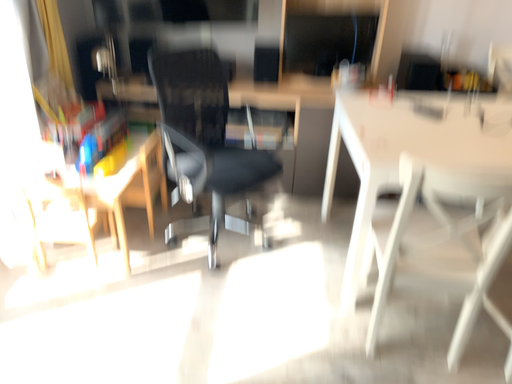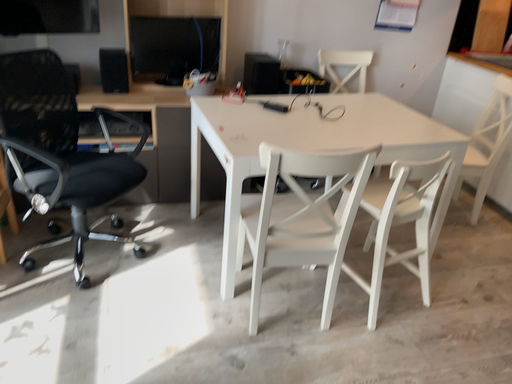
Question: How did the camera likely rotate when shooting the video?

Choices:
 (A) rotated left
 (B) rotated right

Answer: (B)